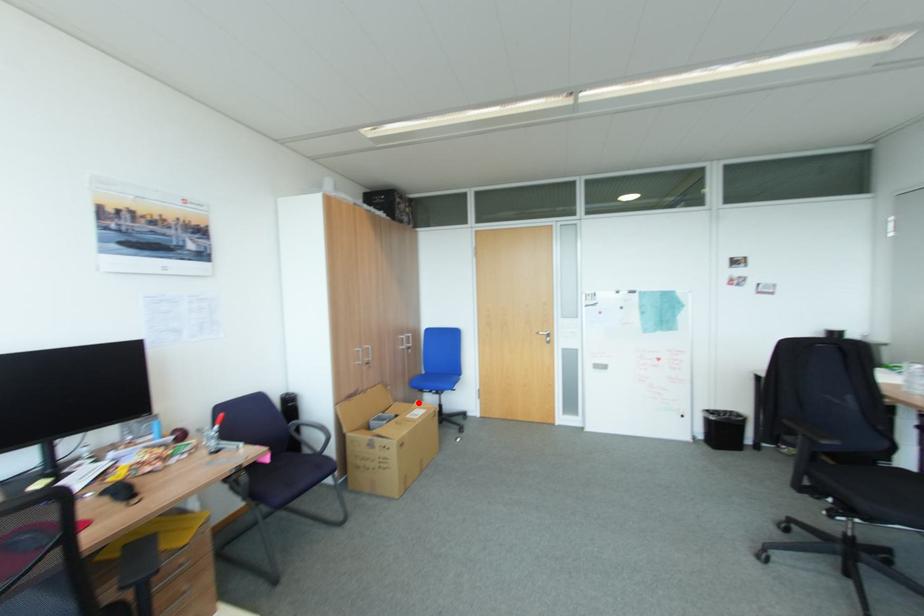
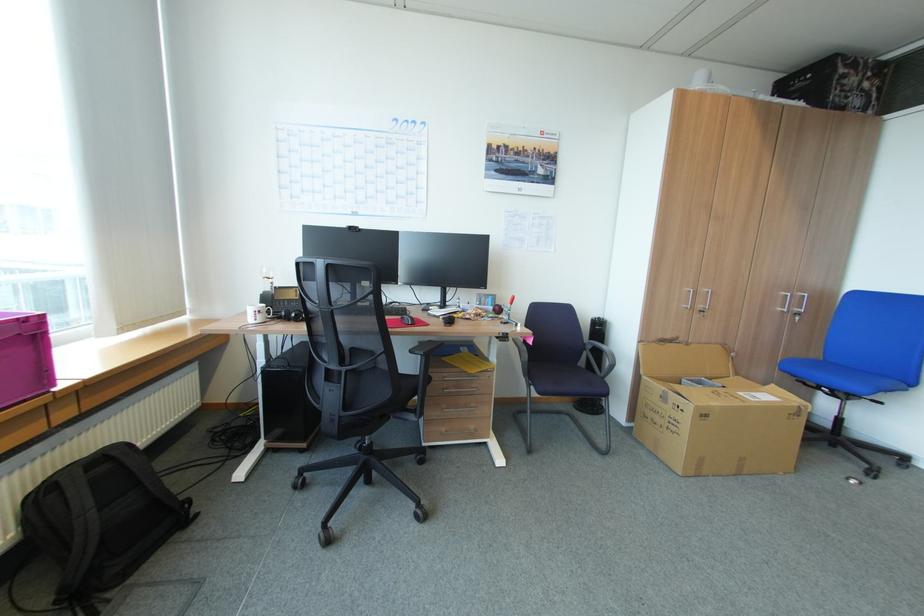
Where in the second image is the point corresponding to the highlighted location from the first image?

(771, 384)